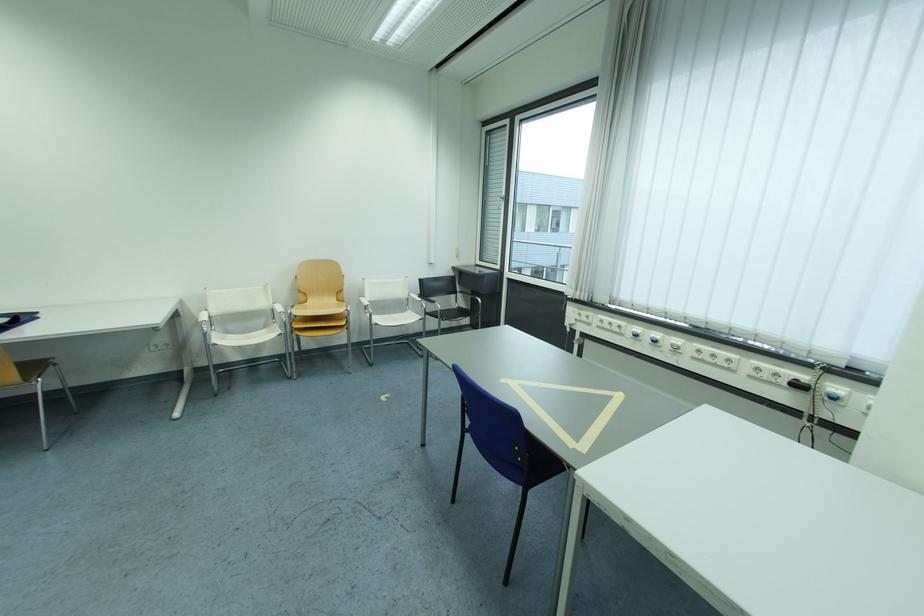
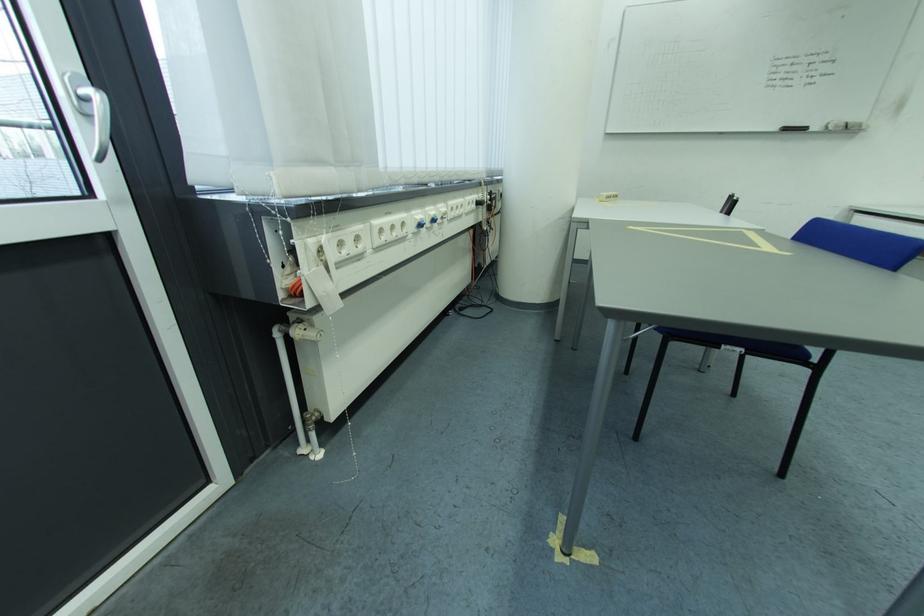
In the second image, find the point that corresponds to (688,346) in the first image.

(454, 212)